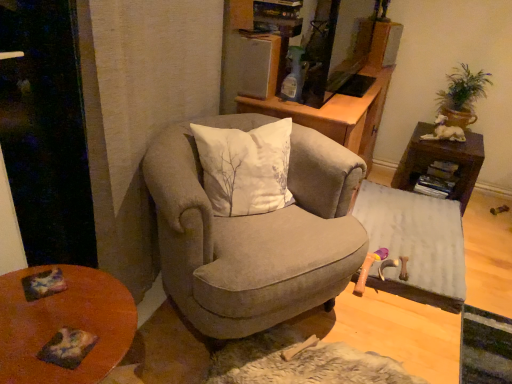
Question: Would you say wooden table at lower left is a long distance from green leafy plant at upper right?

Choices:
 (A) yes
 (B) no

Answer: (A)

Question: Is wooden table at lower left to the left of green leafy plant at upper right from the viewer's perspective?

Choices:
 (A) yes
 (B) no

Answer: (A)

Question: Is wooden table at lower left smaller than green leafy plant at upper right?

Choices:
 (A) no
 (B) yes

Answer: (A)

Question: From a real-world perspective, is wooden table at lower left positioned under green leafy plant at upper right based on gravity?

Choices:
 (A) no
 (B) yes

Answer: (B)

Question: Is wooden table at lower left positioned with its back to green leafy plant at upper right?

Choices:
 (A) yes
 (B) no

Answer: (B)

Question: From the image's perspective, is suede armchair at center above or below wooden cabinet at center?

Choices:
 (A) above
 (B) below

Answer: (B)

Question: Looking at their shapes, would you say suede armchair at center is wider or thinner than wooden cabinet at center?

Choices:
 (A) thin
 (B) wide

Answer: (A)

Question: Relative to wooden cabinet at center, is suede armchair at center in front or behind?

Choices:
 (A) behind
 (B) front

Answer: (B)

Question: Is point (289, 226) positioned closer to the camera than point (352, 104)?

Choices:
 (A) closer
 (B) farther

Answer: (A)

Question: From a real-world perspective, is white fabric ottoman at lower right, marked as the 2th table in a top-to-bottom arrangement, physically located above or below wooden table at lower left?

Choices:
 (A) above
 (B) below

Answer: (B)

Question: Is white fabric ottoman at lower right, marked as the 2th table in a top-to-bottom arrangement, inside or outside of wooden table at lower left?

Choices:
 (A) outside
 (B) inside

Answer: (A)

Question: From the image's perspective, is white fabric ottoman at lower right, marked as the 2th table in a top-to-bottom arrangement, above or below wooden table at lower left?

Choices:
 (A) below
 (B) above

Answer: (B)

Question: Is white fabric ottoman at lower right, marked as the 2th table in a top-to-bottom arrangement, to the left or to the right of wooden table at lower left in the image?

Choices:
 (A) right
 (B) left

Answer: (A)

Question: In the image, is wooden cabinet at center positioned in front of or behind green leafy plant at upper right?

Choices:
 (A) front
 (B) behind

Answer: (A)

Question: In terms of size, does wooden cabinet at center appear bigger or smaller than green leafy plant at upper right?

Choices:
 (A) big
 (B) small

Answer: (A)